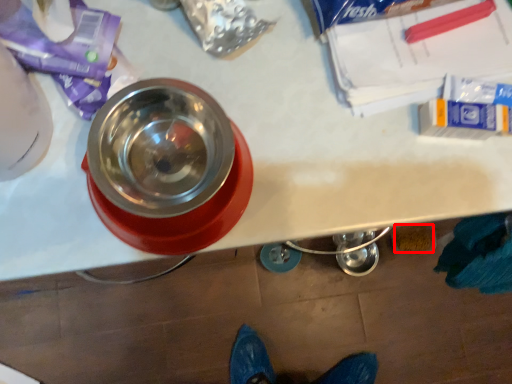
Question: From the image's perspective, considering the relative positions of debris (annotated by the red box) and tableware in the image provided, where is debris (annotated by the red box) located with respect to the staircase?

Choices:
 (A) above
 (B) below

Answer: (B)